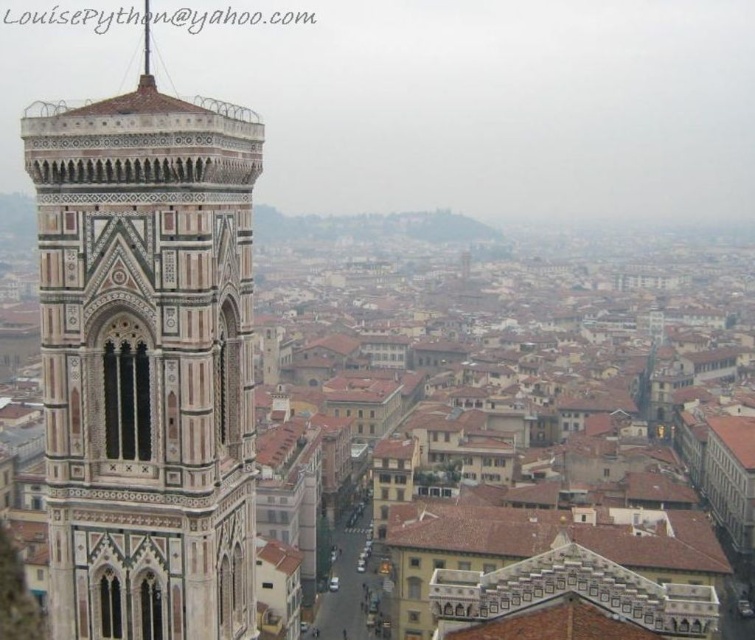
Between marble mosaic bell tower at left and polished silver spire at upper center, which one appears on the right side from the viewer's perspective?

marble mosaic bell tower at left

Can you confirm if marble mosaic bell tower at left is positioned below polished silver spire at upper center?

Correct, marble mosaic bell tower at left is located below polished silver spire at upper center.

Does point (131, 403) come closer to viewer compared to point (148, 56)?

Yes, point (131, 403) is closer to viewer.

Find the location of `marble mosaic bell tower at left`. marble mosaic bell tower at left is located at coordinates (146, 362).